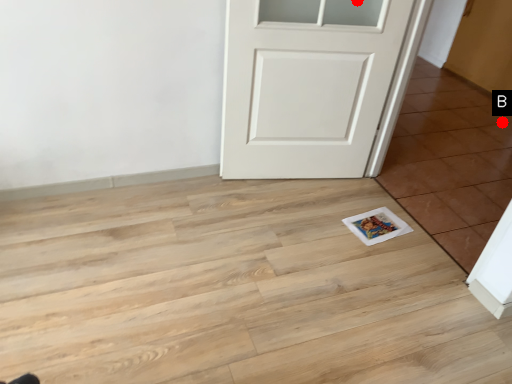
Question: Two points are circled on the image, labeled by A and B beside each circle. Which of the following is the closest to the observer?

Choices:
 (A) A is closer
 (B) B is closer

Answer: (A)